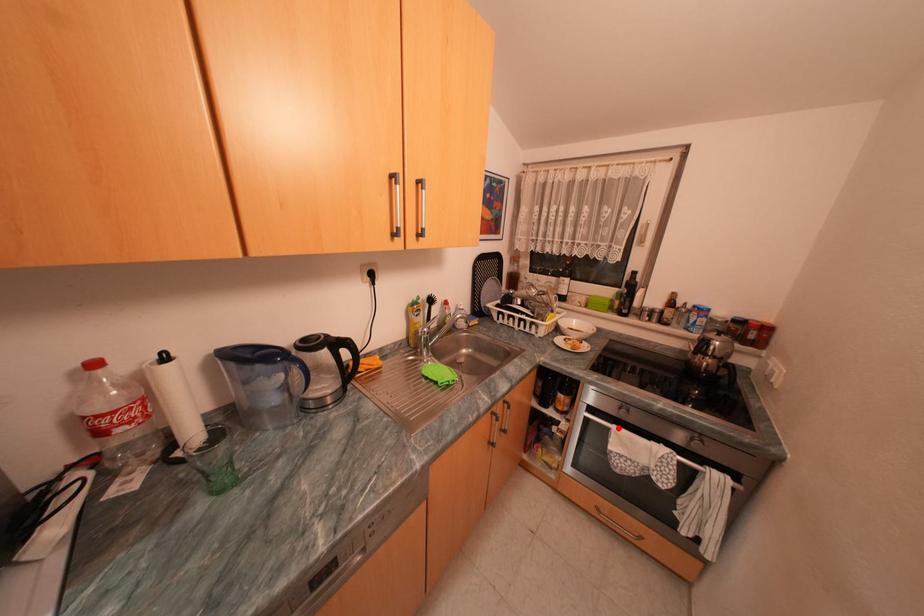
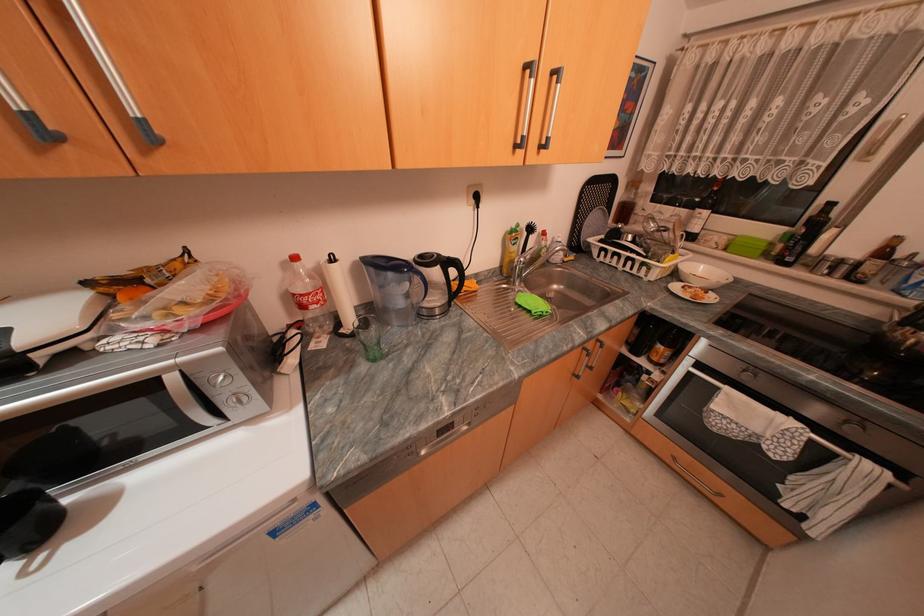
Where in the second image is the point corresponding to the highlighted location from the first image?

(727, 389)